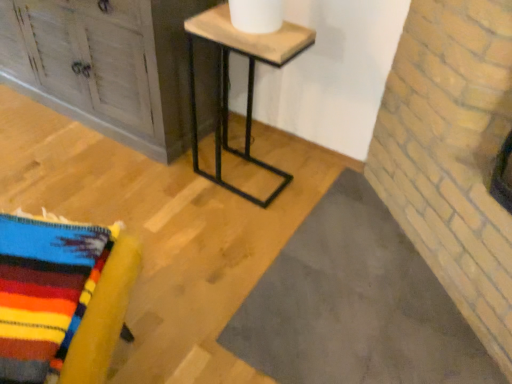
Question: From a real-world perspective, is wooden/marble table at center physically located above or below knitted wool blanket at lower left, which is the second furniture in back-to-front order?

Choices:
 (A) below
 (B) above

Answer: (B)

Question: From their relative heights in the image, would you say wooden/marble table at center is taller or shorter than knitted wool blanket at lower left, which is the second furniture in back-to-front order?

Choices:
 (A) tall
 (B) short

Answer: (A)

Question: Estimate the real-world distances between objects in this image. Which object is farther from the wooden/marble table at center?

Choices:
 (A) knitted wool blanket at lower left, positioned as the second furniture in top-to-bottom order
 (B) distressed wood cabinet at upper left, the 2th furniture positioned from the bottom

Answer: (A)

Question: Which object is the closest to the distressed wood cabinet at upper left, the 2th furniture positioned from the bottom?

Choices:
 (A) knitted wool blanket at lower left, which ranks as the first furniture in bottom-to-top order
 (B) wooden/marble table at center

Answer: (B)